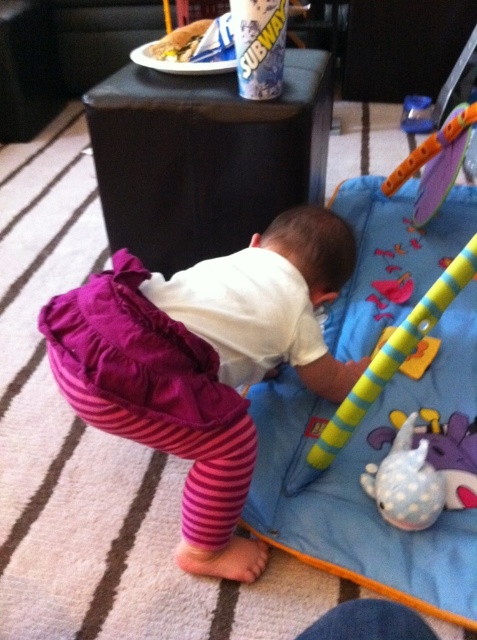
Consider the image. You are a photographer standing at a certain position. You want to take a closeup photo of the blue soft play mat at center. The camera you are using has a minimum focusing distance of 30 inches. Can you take the photo without moving closer?

The blue soft play play mat at center and camera are 34.00 inches apart from each other. Since the minimum focusing distance is 30 inches, the photographer can take the closeup photo without moving closer because the distance is sufficient.

You are a parent trying to reach the baby who is lying on the play mat. There is a point marked at coordinates point (414, 570) that is 36.95 inches away from you. Can you safely extend your hand to touch the baby without overextending?

The distance between you and the point (414, 570) is 36.95 inches. Since this distance is within a comfortable reaching range for an adult, you can safely extend your hand to touch the baby without overextending.

You are a parent trying to clean up the play area. You need to move the white dotted fabric toy at lower right and the blue soft play mat at center. Which object should you move first if you want to place them side by side on the left side of the room?

Since the blue soft play mat at center is already to the right of the white dotted fabric toy at lower right, you should move the blue soft play mat at center first to the left side so that it can be positioned next to the white dotted fabric toy at lower right when both are placed there.